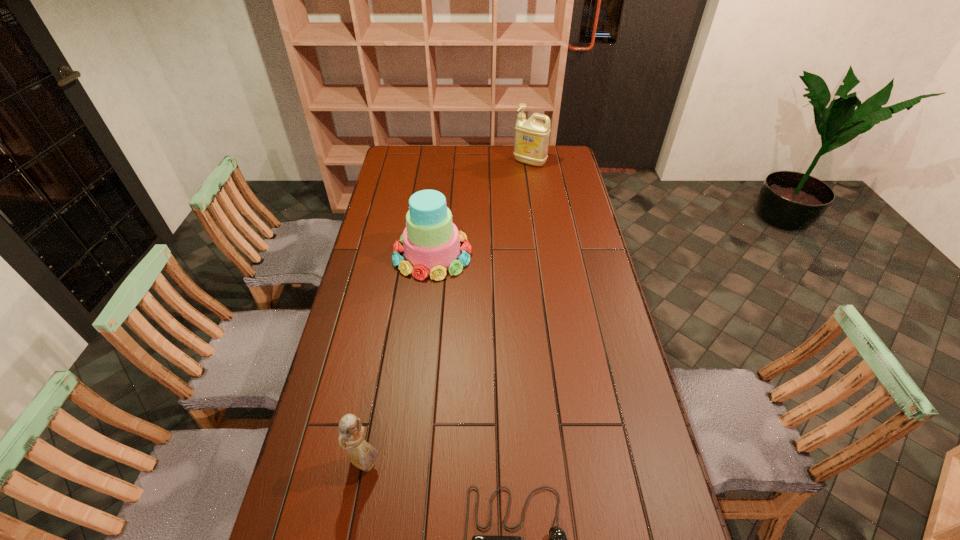
Identify the location of the farthest object. (531, 142).

Image resolution: width=960 pixels, height=540 pixels. Find the location of `cake`. cake is located at coordinates (430, 240).

Locate an element on the screen. The height and width of the screenshot is (540, 960). figurine is located at coordinates (362, 455).

Locate an element on the screen. The image size is (960, 540). the second nearest object is located at coordinates (362, 455).

The height and width of the screenshot is (540, 960). I want to click on blank space located 0.220m on the left of the detergent, so click(468, 162).

At what (x,y) coordinates should I click in order to perform the action: click on vacant space located on the back of the cake. Please return your answer as a coordinate pair (x, y). Looking at the image, I should click on (438, 211).

You are a GUI agent. You are given a task and a screenshot of the screen. Output one action in this format:
    pyautogui.click(x=<x>, y=<y>)
    Task: Click on the free region located 0.260m on the front-facing side of the second shortest object
    
    Given the screenshot: What is the action you would take?
    pyautogui.click(x=482, y=463)

Locate an element on the screen. The height and width of the screenshot is (540, 960). object located at the far edge is located at coordinates (531, 142).

Image resolution: width=960 pixels, height=540 pixels. In order to click on cake that is positioned at the left edge in this screenshot , I will do `click(430, 240)`.

The height and width of the screenshot is (540, 960). What are the coordinates of `figurine positioned at the left edge` in the screenshot? It's located at (362, 455).